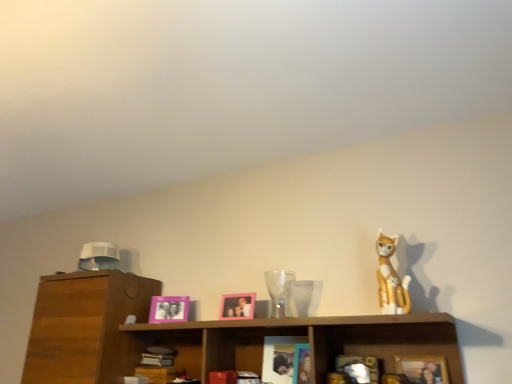
Image resolution: width=512 pixels, height=384 pixels. What do you see at coordinates (280, 291) in the screenshot?
I see `transparent glass vase at center` at bounding box center [280, 291].

Identify the location of matte pink picture frame at center, acting as the first picture frame starting from the right. The width and height of the screenshot is (512, 384). (422, 368).

What are the coordinates of `wooden shelf at center` in the screenshot? It's located at (295, 335).

Locate an element on the screen. matte orange figurine at upper right is located at coordinates tap(391, 279).

This screenshot has width=512, height=384. I want to click on pink plastic picture frame at center, which ranks as the second picture frame in right-to-left order, so click(x=237, y=306).

Is transparent glass vase at center not close to matte orange figurine at upper right?

No.

From the picture: How far apart are transparent glass vase at center and matte orange figurine at upper right?

A distance of 51.92 centimeters exists between transparent glass vase at center and matte orange figurine at upper right.

Considering the relative sizes of transparent glass vase at center and matte orange figurine at upper right in the image provided, is transparent glass vase at center shorter than matte orange figurine at upper right?

Correct, transparent glass vase at center is not as tall as matte orange figurine at upper right.

Would you say transparent glass vase at center is inside or outside matte orange figurine at upper right?

transparent glass vase at center cannot be found inside matte orange figurine at upper right.

Does point (178, 306) come in front of point (281, 295)?

No, (178, 306) is further to viewer.

Considering the sizes of objects pink plastic picture frame at center, the 1th picture frame from the back, and transparent glass vase at center in the image provided, who is smaller, pink plastic picture frame at center, the 1th picture frame from the back, or transparent glass vase at center?

Smaller between the two is pink plastic picture frame at center, the 1th picture frame from the back.

The image size is (512, 384). Identify the location of picture frame that is the 2nd object to the left of the transparent glass vase at center, starting at the anchor. (169, 309).

Find the location of a particular element. The height and width of the screenshot is (384, 512). the 1st picture frame behind when counting from the matte pink picture frame at center, the 1th picture frame in the front-to-back sequence is located at coordinates (237, 306).

Who is bigger, pink plastic picture frame at center, which ranks as the second picture frame in right-to-left order, or matte pink picture frame at center, arranged as the third picture frame when viewed from the left?

matte pink picture frame at center, arranged as the third picture frame when viewed from the left, is bigger.

From the image's perspective, is pink plastic picture frame at center, which appears as the 2th picture frame when viewed from the front, positioned above or below matte pink picture frame at center, arranged as the third picture frame when viewed from the left?

pink plastic picture frame at center, which appears as the 2th picture frame when viewed from the front, is situated higher than matte pink picture frame at center, arranged as the third picture frame when viewed from the left, in the image.

Can you confirm if pink plastic picture frame at center, which appears as the 2th picture frame when viewed from the front, is wider than matte pink picture frame at center, arranged as the third picture frame when viewed from the left?

No, pink plastic picture frame at center, which appears as the 2th picture frame when viewed from the front, is not wider than matte pink picture frame at center, arranged as the third picture frame when viewed from the left.

Could wooden shelf at center be considered to be inside transparent glass vase at center?

No, wooden shelf at center is not a part of transparent glass vase at center.

Considering the positions of point (275, 276) and point (435, 315), is point (275, 276) closer or farther from the camera than point (435, 315)?

Clearly, point (275, 276) is more distant from the camera than point (435, 315).

Does transparent glass vase at center have a lesser height compared to wooden shelf at center?

Indeed, transparent glass vase at center has a lesser height compared to wooden shelf at center.

Can we say matte pink picture frame at center, arranged as the third picture frame when viewed from the left, lies outside wooden shelf at center?

That's incorrect, matte pink picture frame at center, arranged as the third picture frame when viewed from the left, is not completely outside wooden shelf at center.

From the image's perspective, relative to wooden shelf at center, is matte pink picture frame at center, acting as the first picture frame starting from the right, above or below?

Based on their image positions, matte pink picture frame at center, acting as the first picture frame starting from the right, is located above wooden shelf at center.

Is the position of matte pink picture frame at center, arranged as the third picture frame when viewed from the left, less distant than that of wooden shelf at center?

No, matte pink picture frame at center, arranged as the third picture frame when viewed from the left, is further to the viewer.

Considering the relative sizes of matte pink picture frame at center, arranged as the third picture frame when viewed from the left, and wooden shelf at center in the image provided, is matte pink picture frame at center, arranged as the third picture frame when viewed from the left, shorter than wooden shelf at center?

Indeed, matte pink picture frame at center, arranged as the third picture frame when viewed from the left, has a lesser height compared to wooden shelf at center.

From the image's perspective, is transparent glass vase at center beneath matte pink picture frame at center, the 1th picture frame in the front-to-back sequence?

Actually, transparent glass vase at center appears above matte pink picture frame at center, the 1th picture frame in the front-to-back sequence, in the image.

Is transparent glass vase at center oriented away from matte pink picture frame at center, which is the third picture frame in back-to-front order?

No, transparent glass vase at center is not facing the opposite direction of matte pink picture frame at center, which is the third picture frame in back-to-front order.

Which object is closer to the camera, transparent glass vase at center or matte pink picture frame at center, arranged as the third picture frame when viewed from the left?

matte pink picture frame at center, arranged as the third picture frame when viewed from the left, is closer to the camera.

Locate an element on the screen. The image size is (512, 384). picture frame in front of the transparent glass vase at center is located at coordinates (422, 368).

Does point (183, 311) come in front of point (445, 380)?

No.

Is pink plastic picture frame at center, the 1th picture frame from the back, at the left side of matte pink picture frame at center, the 1th picture frame in the front-to-back sequence?

Yes.

In terms of height, does pink plastic picture frame at center, the 1th picture frame from the back, look taller or shorter compared to matte pink picture frame at center, which is the third picture frame in back-to-front order?

pink plastic picture frame at center, the 1th picture frame from the back, is taller than matte pink picture frame at center, which is the third picture frame in back-to-front order.

Does pink plastic picture frame at center, the third picture frame positioned from the right, turn towards matte pink picture frame at center, the 1th picture frame in the front-to-back sequence?

No, pink plastic picture frame at center, the third picture frame positioned from the right, is not oriented towards matte pink picture frame at center, the 1th picture frame in the front-to-back sequence.

This screenshot has height=384, width=512. Identify the location of glass vase that is under the matte orange figurine at upper right (from a real-world perspective). (280, 291).

Identify the location of glass vase that is above the pink plastic picture frame at center, the 1th picture frame from the back (from the image's perspective). (280, 291).

Based on their spatial positions, is matte orange figurine at upper right or matte pink picture frame at center, the 1th picture frame in the front-to-back sequence, closer to pink plastic picture frame at center, the second picture frame when ordered from left to right?

matte orange figurine at upper right.

Estimate the real-world distances between objects in this image. Which object is closer to pink plastic picture frame at center, the second picture frame when ordered from left to right, matte pink picture frame at center, which is the third picture frame in back-to-front order, or pink plastic picture frame at center, the first picture frame when ordered from left to right?

pink plastic picture frame at center, the first picture frame when ordered from left to right, is positioned closer to the anchor pink plastic picture frame at center, the second picture frame when ordered from left to right.

Estimate the real-world distances between objects in this image. Which object is further from transparent glass vase at center, wooden shelf at center or pink plastic picture frame at center, the second picture frame when ordered from left to right?

wooden shelf at center lies further to transparent glass vase at center than the other object.

From the image, which object appears to be nearer to matte orange figurine at upper right, wooden shelf at center or pink plastic picture frame at center, which is the third picture frame in front-to-back order?

wooden shelf at center is positioned closer to the anchor matte orange figurine at upper right.

Looking at this image, from the image, which object appears to be farther from matte pink picture frame at center, arranged as the third picture frame when viewed from the left, transparent glass vase at center or pink plastic picture frame at center, the 1th picture frame from the back?

pink plastic picture frame at center, the 1th picture frame from the back, lies further to matte pink picture frame at center, arranged as the third picture frame when viewed from the left, than the other object.

Which object lies nearer to the anchor point matte orange figurine at upper right, wooden shelf at center or transparent glass vase at center?

wooden shelf at center.

When comparing their distances from pink plastic picture frame at center, the second picture frame when ordered from left to right, does matte orange figurine at upper right or transparent glass vase at center seem closer?

Based on the image, transparent glass vase at center appears to be nearer to pink plastic picture frame at center, the second picture frame when ordered from left to right.

Which object lies further to the anchor point matte orange figurine at upper right, pink plastic picture frame at center, which ranks as the second picture frame in right-to-left order, or transparent glass vase at center?

pink plastic picture frame at center, which ranks as the second picture frame in right-to-left order, is further to matte orange figurine at upper right.

I want to click on glass vase between wooden shelf at center and pink plastic picture frame at center, the second picture frame when ordered from left to right, from front to back, so click(280, 291).

Locate an element on the screen. This screenshot has height=384, width=512. glass vase between wooden shelf at center and matte pink picture frame at center, which is the third picture frame in back-to-front order is located at coordinates (280, 291).

At what (x,y) coordinates should I click in order to perform the action: click on glass vase between wooden shelf at center and matte orange figurine at upper right. Please return your answer as a coordinate pair (x, y). Image resolution: width=512 pixels, height=384 pixels. Looking at the image, I should click on (280, 291).

At what (x,y) coordinates should I click in order to perform the action: click on shelf situated between pink plastic picture frame at center, which ranks as the second picture frame in right-to-left order, and matte pink picture frame at center, which is the third picture frame in back-to-front order, from left to right. Please return your answer as a coordinate pair (x, y). Image resolution: width=512 pixels, height=384 pixels. Looking at the image, I should click on (295, 335).